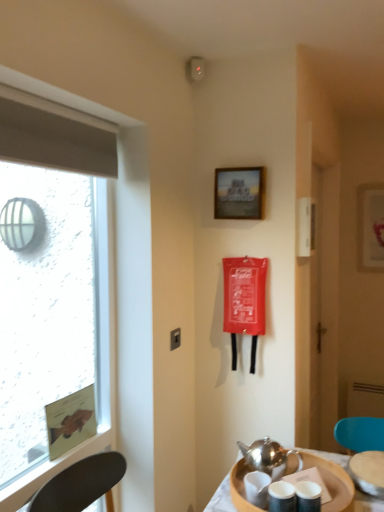
Locate an element on the screen. The image size is (384, 512). wooden tray at lower right is located at coordinates (221, 498).

At what (x,y) coordinates should I click in order to perform the action: click on metallic silver teapot at lower right. Please return your answer as a coordinate pair (x, y). The width and height of the screenshot is (384, 512). Looking at the image, I should click on (368, 472).

At what (x,y) coordinates should I click in order to perform the action: click on polished silver teapot at lower center. Please return your answer as a coordinate pair (x, y). This screenshot has height=512, width=384. Looking at the image, I should click on (268, 456).

From the picture: From a real-world perspective, is metallic silver teapot at lower right physically located above or below white glossy picture frame at upper right, placed as the second picture frame when sorted from left to right?

metallic silver teapot at lower right is below white glossy picture frame at upper right, placed as the second picture frame when sorted from left to right.

Which object is closer to the camera, metallic silver teapot at lower right or white glossy picture frame at upper right, arranged as the 1th picture frame when viewed from the back?

metallic silver teapot at lower right.

Can you confirm if metallic silver teapot at lower right is wider than white glossy picture frame at upper right, arranged as the 1th picture frame when viewed from the back?

Yes.

Does metallic silver teapot at lower right have a greater height compared to white glossy picture frame at upper right, which is the first picture frame from right to left?

Incorrect, the height of metallic silver teapot at lower right is not larger of that of white glossy picture frame at upper right, which is the first picture frame from right to left.

Which point is more distant from viewer, (206,508) or (218,202)?

Positioned behind is point (218,202).

Would you say wooden tray at lower right is to the left or to the right of wooden frame at upper center, placed as the 1th picture frame when sorted from front to back, in the picture?

From the image, it's evident that wooden tray at lower right is to the right of wooden frame at upper center, placed as the 1th picture frame when sorted from front to back.

Is wooden tray at lower right in front of or behind wooden frame at upper center, the first picture frame in the left-to-right sequence, in the image?

Clearly, wooden tray at lower right is in front of wooden frame at upper center, the first picture frame in the left-to-right sequence.

From the image's perspective, between wooden tray at lower right and wooden frame at upper center, the first picture frame in the left-to-right sequence, who is located below?

wooden tray at lower right, from the image's perspective.

From a real-world perspective, who is located lower, white glossy picture frame at upper right, arranged as the 1th picture frame when viewed from the back, or polished silver teapot at lower center?

From a 3D spatial view, polished silver teapot at lower center is below.

Who is smaller, white glossy picture frame at upper right, which ranks as the second picture frame in front-to-back order, or polished silver teapot at lower center?

polished silver teapot at lower center is smaller.

Could you tell me if white glossy picture frame at upper right, which ranks as the second picture frame in front-to-back order, is turned towards polished silver teapot at lower center?

Yes, white glossy picture frame at upper right, which ranks as the second picture frame in front-to-back order, is turned towards polished silver teapot at lower center.

Is transparent glass window at left located outside white glossy picture frame at upper right, which ranks as the second picture frame in front-to-back order?

Absolutely, transparent glass window at left is external to white glossy picture frame at upper right, which ranks as the second picture frame in front-to-back order.

Which picture frame is the 2nd one when counting from the right side of the transparent glass window at left? Please provide its 2D coordinates.

[(371, 227)]

Is the position of transparent glass window at left less distant than that of white glossy picture frame at upper right, arranged as the 1th picture frame when viewed from the back?

That is True.

Based on the photo, between wooden frame at upper center, the second picture frame when ordered from right to left, and polished silver teapot at lower center, which one is positioned in front?

Positioned in front is polished silver teapot at lower center.

Considering the positions of objects wooden frame at upper center, the second picture frame when ordered from right to left, and polished silver teapot at lower center in the image provided, who is more to the right, wooden frame at upper center, the second picture frame when ordered from right to left, or polished silver teapot at lower center?

polished silver teapot at lower center is more to the right.

You are a GUI agent. You are given a task and a screenshot of the screen. Output one action in this format:
    pyautogui.click(x=<x>, y=<y>)
    Task: Click on the 1st picture frame behind the polished silver teapot at lower center, counting from the anchor's position
    The width and height of the screenshot is (384, 512).
    Given the screenshot: What is the action you would take?
    pyautogui.click(x=238, y=193)

Is wooden frame at upper center, the first picture frame in the left-to-right sequence, bigger or smaller than polished silver teapot at lower center?

Considering their sizes, wooden frame at upper center, the first picture frame in the left-to-right sequence, takes up more space than polished silver teapot at lower center.

From the image's perspective, which one is positioned higher, white glossy picture frame at upper right, arranged as the 1th picture frame when viewed from the back, or wooden tray at lower right?

white glossy picture frame at upper right, arranged as the 1th picture frame when viewed from the back, from the image's perspective.

Considering the positions of objects white glossy picture frame at upper right, which is the first picture frame from right to left, and wooden tray at lower right in the image provided, who is behind, white glossy picture frame at upper right, which is the first picture frame from right to left, or wooden tray at lower right?

white glossy picture frame at upper right, which is the first picture frame from right to left, is further away from the camera.

Where is `table below the white glossy picture frame at upper right, arranged as the 1th picture frame when viewed from the back (from the image's perspective)`? This screenshot has width=384, height=512. table below the white glossy picture frame at upper right, arranged as the 1th picture frame when viewed from the back (from the image's perspective) is located at coordinates (221, 498).

From the image's perspective, which one is positioned higher, white glossy picture frame at upper right, arranged as the 1th picture frame when viewed from the back, or transparent glass window at left?

white glossy picture frame at upper right, arranged as the 1th picture frame when viewed from the back.

Is the position of white glossy picture frame at upper right, placed as the second picture frame when sorted from left to right, less distant than that of transparent glass window at left?

No, white glossy picture frame at upper right, placed as the second picture frame when sorted from left to right, is behind transparent glass window at left.

From a real-world perspective, which is physically below, white glossy picture frame at upper right, placed as the second picture frame when sorted from left to right, or transparent glass window at left?

transparent glass window at left is physically lower.

Is white glossy picture frame at upper right, which is the first picture frame from right to left, facing away from transparent glass window at left?

white glossy picture frame at upper right, which is the first picture frame from right to left, does not have its back to transparent glass window at left.

From the metallic silver teapot at lower right, count 2nd picture frames backward and point to it. Please provide its 2D coordinates.

[(371, 227)]

What are the coordinates of `table beneath the wooden frame at upper center, marked as the 2th picture frame in a back-to-front arrangement (from a real-world perspective)` in the screenshot? It's located at (221, 498).

Considering their positions, is white glossy picture frame at upper right, which is the first picture frame from right to left, positioned closer to wooden frame at upper center, the first picture frame in the left-to-right sequence, than metallic silver teapot at lower right?

The object closer to wooden frame at upper center, the first picture frame in the left-to-right sequence, is metallic silver teapot at lower right.

When comparing their distances from wooden tray at lower right, does wooden frame at upper center, the first picture frame in the left-to-right sequence, or white glossy picture frame at upper right, arranged as the 1th picture frame when viewed from the back, seem closer?

wooden frame at upper center, the first picture frame in the left-to-right sequence, is positioned closer to the anchor wooden tray at lower right.

Looking at the image, which one is located further to wooden tray at lower right, white glossy picture frame at upper right, which ranks as the second picture frame in front-to-back order, or metallic silver teapot at lower right?

white glossy picture frame at upper right, which ranks as the second picture frame in front-to-back order.

Based on their spatial positions, is polished silver teapot at lower center or wooden frame at upper center, the second picture frame when ordered from right to left, further from metallic silver teapot at lower right?

Among the two, wooden frame at upper center, the second picture frame when ordered from right to left, is located further to metallic silver teapot at lower right.

Based on the photo, which object lies nearer to the anchor point wooden tray at lower right, transparent glass window at left or wooden frame at upper center, the second picture frame when ordered from right to left?

The object closer to wooden tray at lower right is transparent glass window at left.

Considering their positions, is wooden tray at lower right positioned further to wooden frame at upper center, the first picture frame in the left-to-right sequence, than polished silver teapot at lower center?

Based on the image, wooden tray at lower right appears to be further to wooden frame at upper center, the first picture frame in the left-to-right sequence.

Estimate the real-world distances between objects in this image. Which object is closer to wooden tray at lower right, polished silver teapot at lower center or metallic silver teapot at lower right?

polished silver teapot at lower center lies closer to wooden tray at lower right than the other object.

Estimate the real-world distances between objects in this image. Which object is further from white glossy picture frame at upper right, arranged as the 1th picture frame when viewed from the back, polished silver teapot at lower center or metallic silver teapot at lower right?

The object further to white glossy picture frame at upper right, arranged as the 1th picture frame when viewed from the back, is polished silver teapot at lower center.

In order to click on table between polished silver teapot at lower center and metallic silver teapot at lower right from left to right in this screenshot , I will do `click(221, 498)`.

Locate an element on the screen. tea set located between metallic silver teapot at lower right and white glossy picture frame at upper right, which is the first picture frame from right to left, in the depth direction is located at coordinates (268, 456).

The width and height of the screenshot is (384, 512). Identify the location of tea set between transparent glass window at left and metallic silver teapot at lower right from left to right. [268, 456].

The height and width of the screenshot is (512, 384). What are the coordinates of `picture frame located between metallic silver teapot at lower right and white glossy picture frame at upper right, placed as the second picture frame when sorted from left to right, in the depth direction` in the screenshot? It's located at (238, 193).